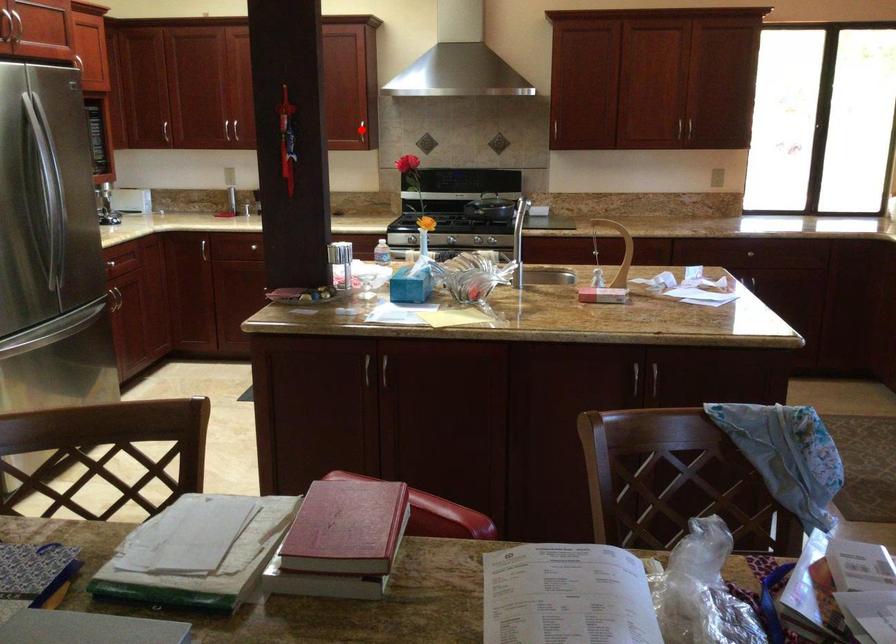
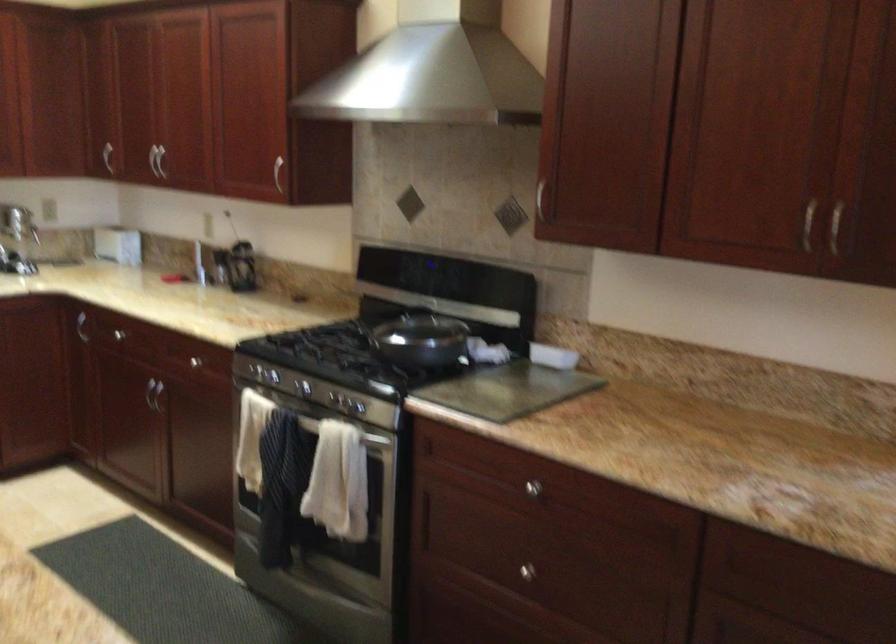
Question: I am providing you with two images of the same scene from different viewpoints. A red point is marked on the first image. Is the red point's position out of view in image 2?

Choices:
 (A) Yes
 (B) No

Answer: (A)